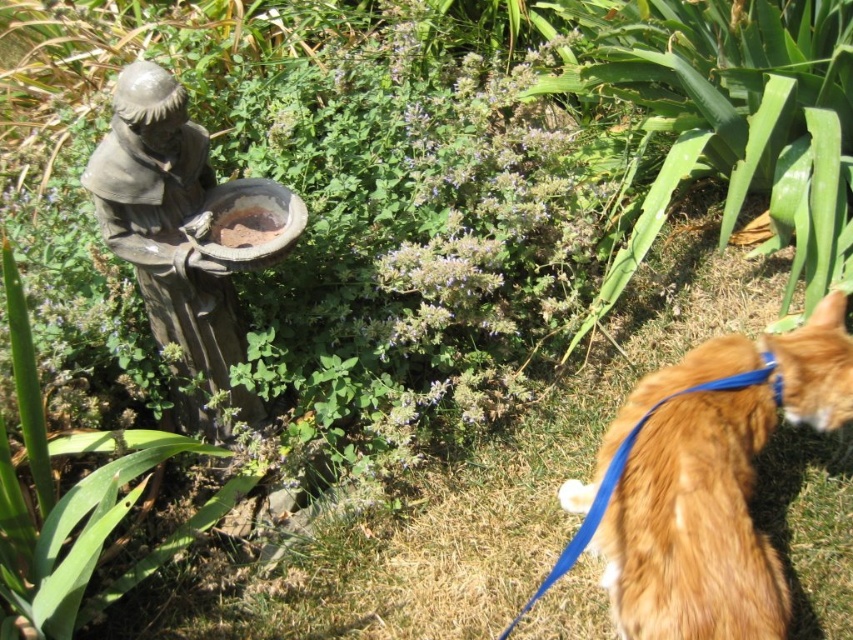
Who is more distant from viewer, [709,529] or [143,241]?

The point [143,241] is more distant.

Is orange fur at lower right thinner than gray stone statue at upper left?

Incorrect, orange fur at lower right's width is not less than gray stone statue at upper left's.

Between point (737, 515) and point (279, 189), which one is positioned in front?

Point (737, 515) is more forward.

The image size is (853, 640). What are the coordinates of `orange fur at lower right` in the screenshot? It's located at (694, 525).

Identify the location of gray stone statue at upper left. (180, 227).

Can you confirm if gray stone statue at upper left is wider than matte brown bowl at center?

Correct, the width of gray stone statue at upper left exceeds that of matte brown bowl at center.

This screenshot has width=853, height=640. Describe the element at coordinates (180, 227) in the screenshot. I see `gray stone statue at upper left` at that location.

Image resolution: width=853 pixels, height=640 pixels. I want to click on gray stone statue at upper left, so click(x=180, y=227).

Can you confirm if orange fur at lower right is positioned to the right of matte brown bowl at center?

Yes, orange fur at lower right is to the right of matte brown bowl at center.

Who is positioned more to the right, orange fur at lower right or matte brown bowl at center?

orange fur at lower right

Image resolution: width=853 pixels, height=640 pixels. In order to click on orange fur at lower right in this screenshot , I will do `click(694, 525)`.